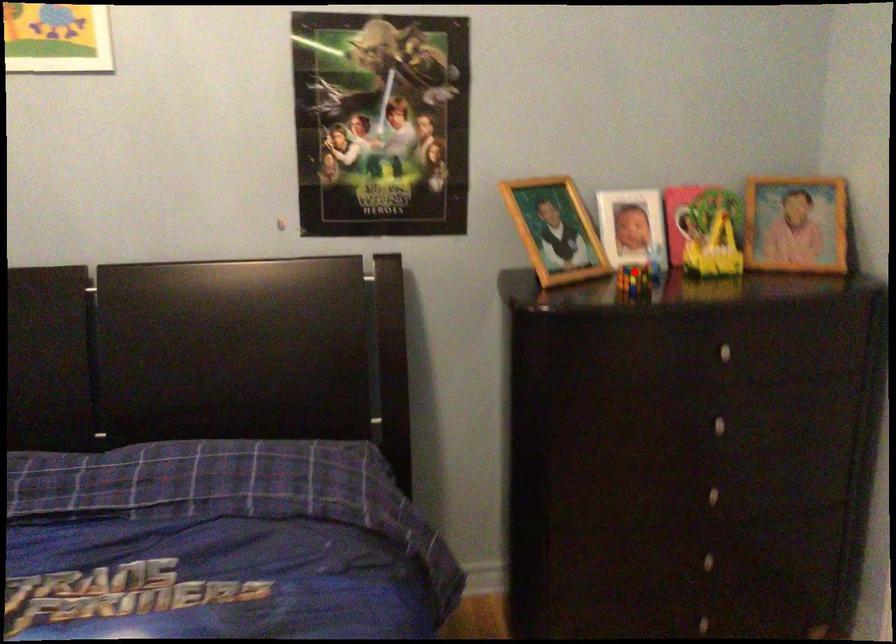
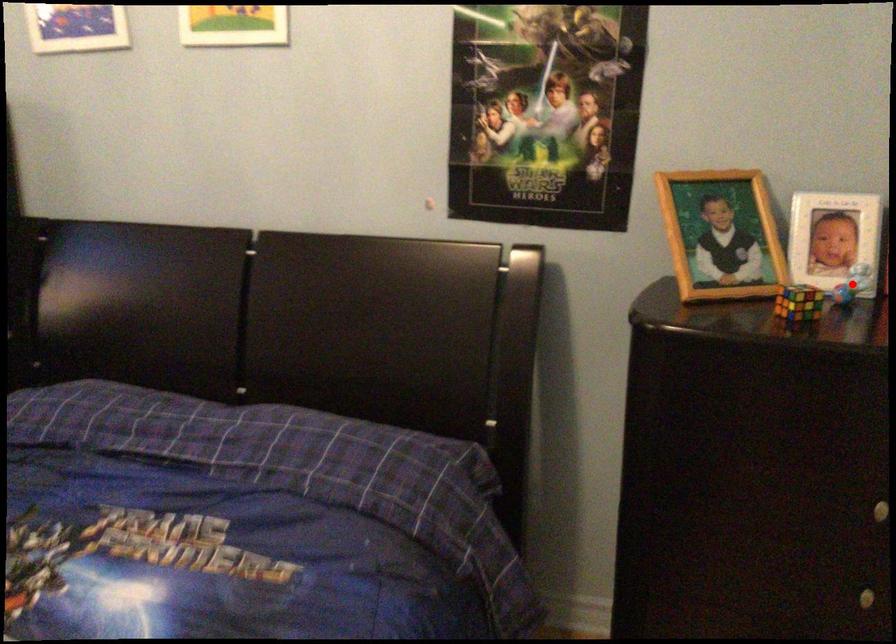
I am providing you with two images of the same scene from different viewpoints. A red point is marked on the first image and another point is marked on the second image. Is the marked point in image1 the same physical position as the marked point in image2?

No